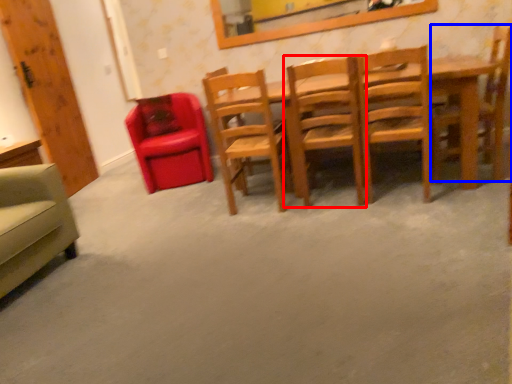
Question: Which point is closer to the camera, chair (highlighted by a red box) or chair (highlighted by a blue box)?

Choices:
 (A) chair
 (B) chair

Answer: (A)